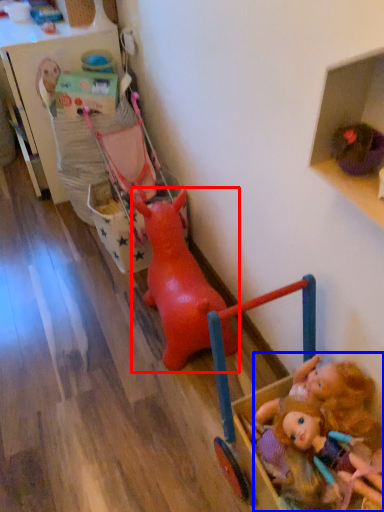
Question: Which object is closer to the camera taking this photo, toy (highlighted by a red box) or person (highlighted by a blue box)?

Choices:
 (A) toy
 (B) person

Answer: (B)